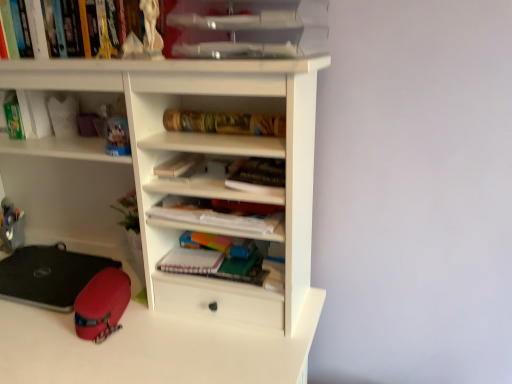
Question: Can you confirm if gold metallic tube at center, the second book viewed from the top, is bigger than rubberized red case at lower left?

Choices:
 (A) no
 (B) yes

Answer: (A)

Question: Does gold metallic tube at center, the second book viewed from the top, have a lesser height compared to rubberized red case at lower left?

Choices:
 (A) no
 (B) yes

Answer: (A)

Question: Is gold metallic tube at center, the second book viewed from the top, at the right side of rubberized red case at lower left?

Choices:
 (A) yes
 (B) no

Answer: (A)

Question: Considering the relative positions of gold metallic tube at center, the second book viewed from the top, and rubberized red case at lower left in the image provided, is gold metallic tube at center, the second book viewed from the top, to the left of rubberized red case at lower left from the viewer's perspective?

Choices:
 (A) yes
 (B) no

Answer: (B)

Question: Is gold metallic tube at center, arranged as the third book when ordered from the bottom, placed right next to rubberized red case at lower left?

Choices:
 (A) yes
 (B) no

Answer: (B)

Question: From a real-world perspective, is gold metallic tube at center, the second book viewed from the top, beneath rubberized red case at lower left?

Choices:
 (A) yes
 (B) no

Answer: (B)

Question: From a real-world perspective, is hardcover book at upper left, which appears as the 4th book when ordered from the bottom, over clear plastic trays at upper center?

Choices:
 (A) no
 (B) yes

Answer: (B)

Question: Can you confirm if hardcover book at upper left, the 1th book when ordered from top to bottom, is taller than clear plastic trays at upper center?

Choices:
 (A) no
 (B) yes

Answer: (B)

Question: Are hardcover book at upper left, which appears as the 4th book when ordered from the bottom, and clear plastic trays at upper center located far from each other?

Choices:
 (A) yes
 (B) no

Answer: (B)

Question: Is hardcover book at upper left, which appears as the 4th book when ordered from the bottom, positioned before clear plastic trays at upper center?

Choices:
 (A) no
 (B) yes

Answer: (A)

Question: Considering the relative positions of hardcover book at upper left, which appears as the 4th book when ordered from the bottom, and clear plastic trays at upper center in the image provided, is hardcover book at upper left, which appears as the 4th book when ordered from the bottom, behind clear plastic trays at upper center?

Choices:
 (A) no
 (B) yes

Answer: (B)

Question: Can you confirm if hardcover book at upper left, the 1th book when ordered from top to bottom, is thinner than clear plastic trays at upper center?

Choices:
 (A) yes
 (B) no

Answer: (A)

Question: Would you say white matte paper at center, which appears as the second paperback book when ordered from the bottom, is outside clear plastic trays at upper center?

Choices:
 (A) no
 (B) yes

Answer: (B)